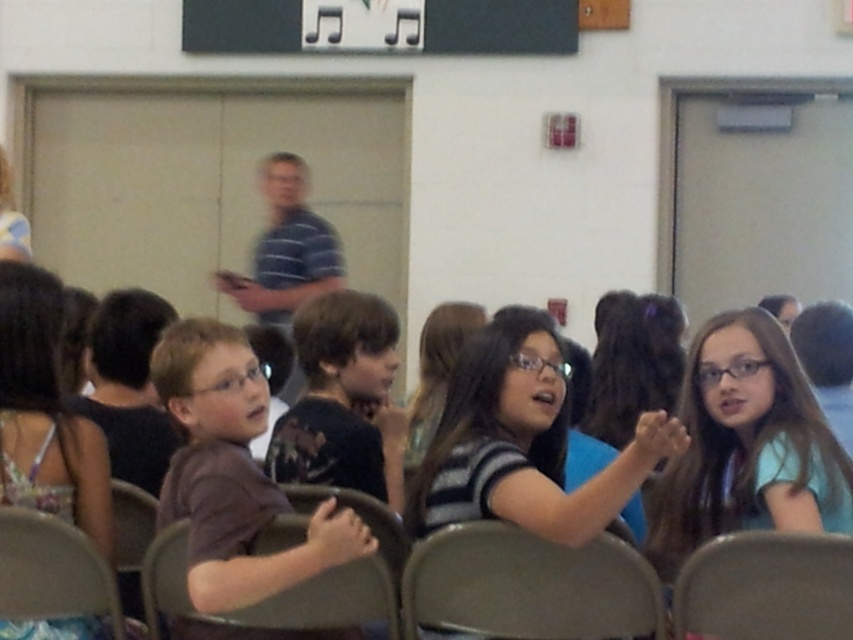
Can you confirm if metallic gray chair at center is wider than metallic gray chair at lower right?

Indeed, metallic gray chair at center has a greater width compared to metallic gray chair at lower right.

Which of these two, metallic gray chair at center or metallic gray chair at lower right, stands shorter?

Standing shorter between the two is metallic gray chair at lower right.

Where is `metallic gray chair at center`? Image resolution: width=853 pixels, height=640 pixels. metallic gray chair at center is located at coordinates (527, 586).

This screenshot has height=640, width=853. What do you see at coordinates (231, 472) in the screenshot?
I see `brown matte shirt at center` at bounding box center [231, 472].

Is brown matte shirt at center to the left of metallic gray chair at lower right from the viewer's perspective?

Correct, you'll find brown matte shirt at center to the left of metallic gray chair at lower right.

Where is `brown matte shirt at center`? This screenshot has width=853, height=640. brown matte shirt at center is located at coordinates (231, 472).

Who is positioned more to the right, metallic gray chair at center or black matte music notes at upper center?

metallic gray chair at center

Is point (537, 573) closer to camera compared to point (277, 13)?

Yes, point (537, 573) is closer to viewer.

Is point (573, 548) positioned after point (210, 28)?

No, it is not.

Locate an element on the screen. The image size is (853, 640). metallic gray chair at center is located at coordinates (527, 586).